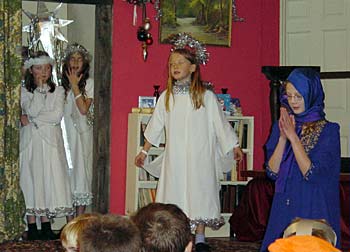
Locate an element on the screen. The width and height of the screenshot is (350, 252). painting is located at coordinates (198, 20).